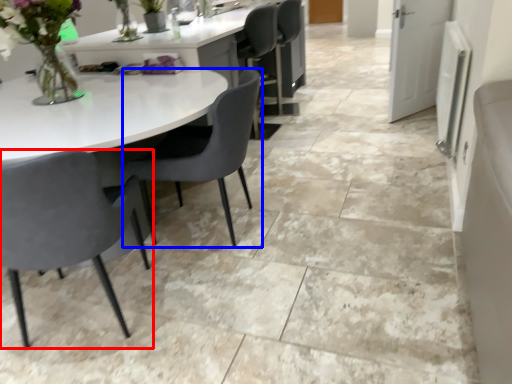
Question: Which object is closer to the camera taking this photo, chair (highlighted by a red box) or chair (highlighted by a blue box)?

Choices:
 (A) chair
 (B) chair

Answer: (A)